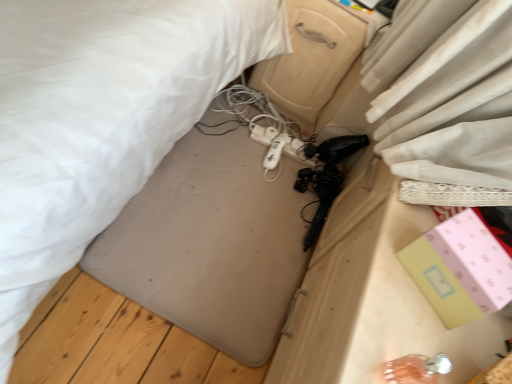
The height and width of the screenshot is (384, 512). I want to click on free point in front of beige plastic drawer at center, so click(x=248, y=145).